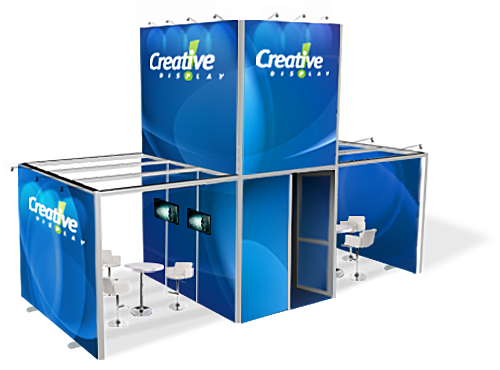
I want to click on branded cubicles, so click(x=202, y=274), click(x=393, y=245).